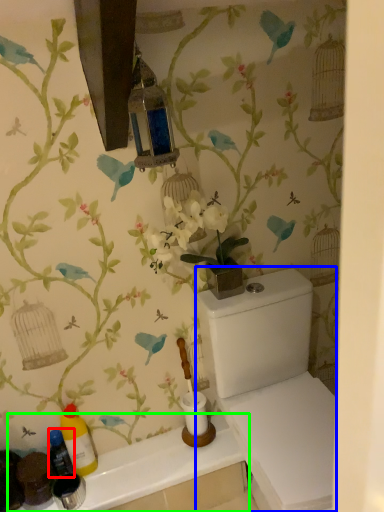
Question: Which object is positioned closest to bottle (highlighted by a red box)? Select from porcelain (highlighted by a blue box) and counter top (highlighted by a green box).

Choices:
 (A) porcelain
 (B) counter top

Answer: (B)